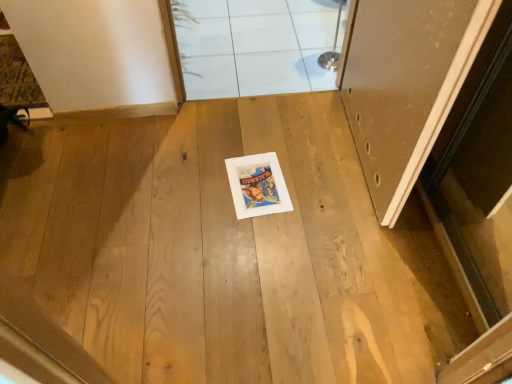
Question: Considering the relative sizes of white glossy tile at upper center and matte white door at right in the image provided, is white glossy tile at upper center taller than matte white door at right?

Choices:
 (A) no
 (B) yes

Answer: (A)

Question: Is white glossy tile at upper center bigger than matte white door at right?

Choices:
 (A) no
 (B) yes

Answer: (A)

Question: Considering the relative positions of white glossy tile at upper center and matte white door at right in the image provided, is white glossy tile at upper center behind matte white door at right?

Choices:
 (A) no
 (B) yes

Answer: (B)

Question: From the image's perspective, is white glossy tile at upper center located beneath matte white door at right?

Choices:
 (A) yes
 (B) no

Answer: (B)

Question: Is white glossy tile at upper center thinner than matte white door at right?

Choices:
 (A) yes
 (B) no

Answer: (B)

Question: Does white glossy tile at upper center have a lesser height compared to matte white door at right?

Choices:
 (A) no
 (B) yes

Answer: (B)

Question: From a real-world perspective, is matte white door at right located higher than white glossy tile at upper center?

Choices:
 (A) yes
 (B) no

Answer: (A)

Question: Is matte white door at right touching white glossy tile at upper center?

Choices:
 (A) yes
 (B) no

Answer: (B)

Question: From a real-world perspective, is matte white door at right positioned under white glossy tile at upper center based on gravity?

Choices:
 (A) yes
 (B) no

Answer: (B)

Question: Would you say matte white door at right contains white glossy tile at upper center?

Choices:
 (A) yes
 (B) no

Answer: (B)

Question: Does matte white door at right lie behind white glossy tile at upper center?

Choices:
 (A) yes
 (B) no

Answer: (B)

Question: Is matte white door at right facing towards white glossy tile at upper center?

Choices:
 (A) no
 (B) yes

Answer: (A)

Question: Is white glossy tile at upper center surrounded by white tile at upper center?

Choices:
 (A) no
 (B) yes

Answer: (A)